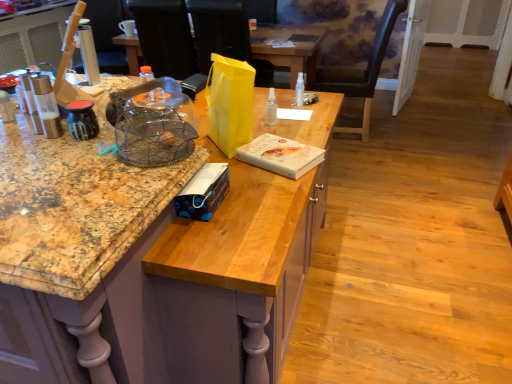
Locate an element on the screen. The image size is (512, 384). free location to the right of black leather chair at upper right is located at coordinates (407, 132).